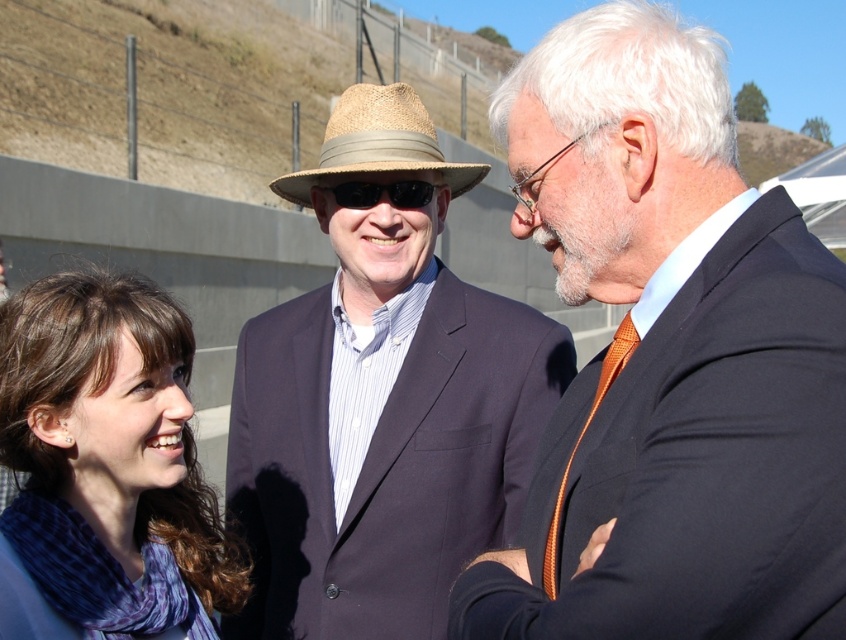
The width and height of the screenshot is (846, 640). What do you see at coordinates (668, 358) in the screenshot? I see `matte black suit at center` at bounding box center [668, 358].

Can you confirm if matte black suit at center is positioned to the left of blue plaid scarf at lower left?

Incorrect, matte black suit at center is not on the left side of blue plaid scarf at lower left.

Which is in front, point (748, 420) or point (130, 387)?

Point (748, 420)

Identify the location of matte black suit at center. This screenshot has width=846, height=640. (668, 358).

Does blue plaid scarf at lower left appear over orange woven tie at center?

No.

Is point (129, 284) farther from camera compared to point (599, 376)?

That is True.

Where is `blue plaid scarf at lower left`? The height and width of the screenshot is (640, 846). blue plaid scarf at lower left is located at coordinates (106, 468).

Identify the location of blue plaid scarf at lower left. The height and width of the screenshot is (640, 846). (106, 468).

Does matte black suit at center appear under strawhat at center?

Yes.

Does point (658, 356) lie behind point (416, 116)?

No, (658, 356) is in front of (416, 116).

Which is behind, point (597, 545) or point (323, 168)?

Positioned behind is point (323, 168).

Find the location of `matte black suit at center`. matte black suit at center is located at coordinates (668, 358).